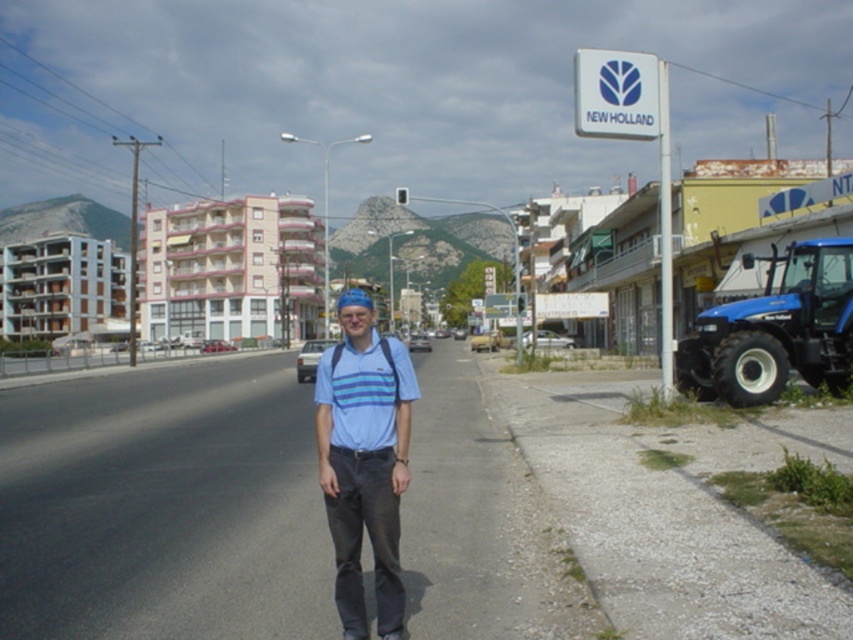
Measure the distance from blue striped shirt at center to blue rubber tractor at right.

blue striped shirt at center and blue rubber tractor at right are 10.77 meters apart from each other.

Is the position of blue striped shirt at center more distant than that of blue rubber tractor at right?

No, it is in front of blue rubber tractor at right.

Locate an element on the screen. blue striped shirt at center is located at coordinates (364, 460).

Is point (717, 320) farther from camera compared to point (390, 342)?

Yes, it is.

From the picture: Does blue rubber tractor at right appear over blue striped polo shirt at center?

Indeed, blue rubber tractor at right is positioned over blue striped polo shirt at center.

Where is `blue rubber tractor at right`? The height and width of the screenshot is (640, 853). blue rubber tractor at right is located at coordinates (775, 330).

The image size is (853, 640). Describe the element at coordinates (364, 460) in the screenshot. I see `blue striped shirt at center` at that location.

Identify the location of blue striped shirt at center. coord(364,460).

This screenshot has width=853, height=640. Find the location of `blue striped shirt at center`. blue striped shirt at center is located at coordinates (364, 460).